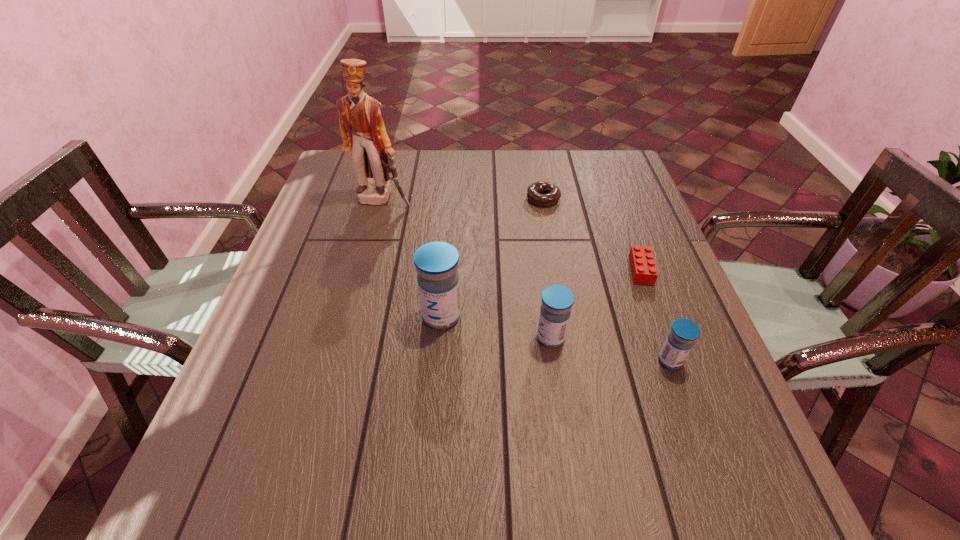
Please show where to add a medicine on the left while keeping spacing even. Please provide its 2D coordinates. Your answer should be formatted as a tuple, i.e. [(x, y)], where the tuple contains the x and y coordinates of a point satisfying the conditions above.

[(341, 296)]